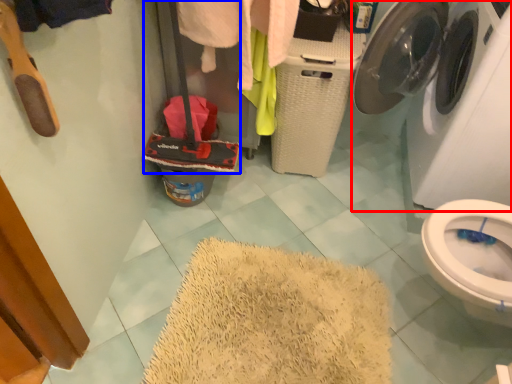
Question: Which object appears farthest to the camera in this image, washing machine (highlighted by a red box) or luggage (highlighted by a blue box)?

Choices:
 (A) washing machine
 (B) luggage

Answer: (B)